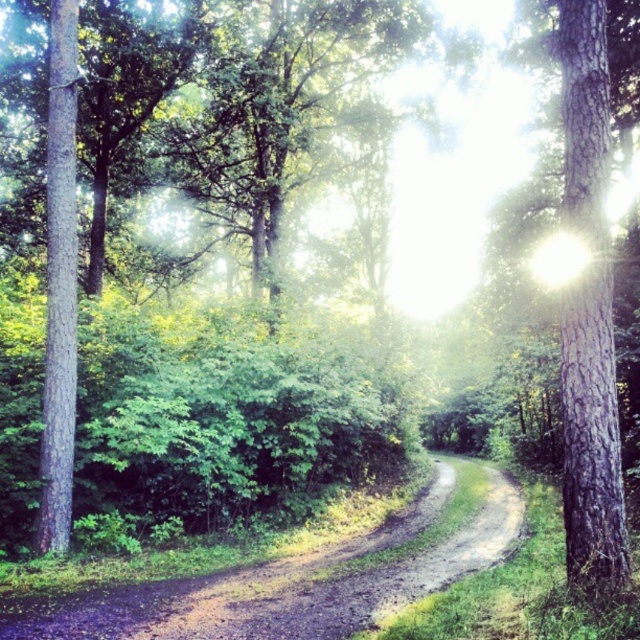
Question: Which point appears closest to the camera in this image?

Choices:
 (A) (148, 630)
 (B) (595, 532)

Answer: (B)

Question: Can you confirm if dusty brown dirt track at center is positioned to the left of smooth bark tree at right?

Choices:
 (A) yes
 (B) no

Answer: (A)

Question: Is dusty brown dirt track at center to the left of smooth bark tree at right from the viewer's perspective?

Choices:
 (A) yes
 (B) no

Answer: (A)

Question: Which of the following is the farthest from the observer?

Choices:
 (A) (593, 500)
 (B) (460, 532)

Answer: (B)

Question: Does dusty brown dirt track at center appear under smooth bark tree at right?

Choices:
 (A) yes
 (B) no

Answer: (A)